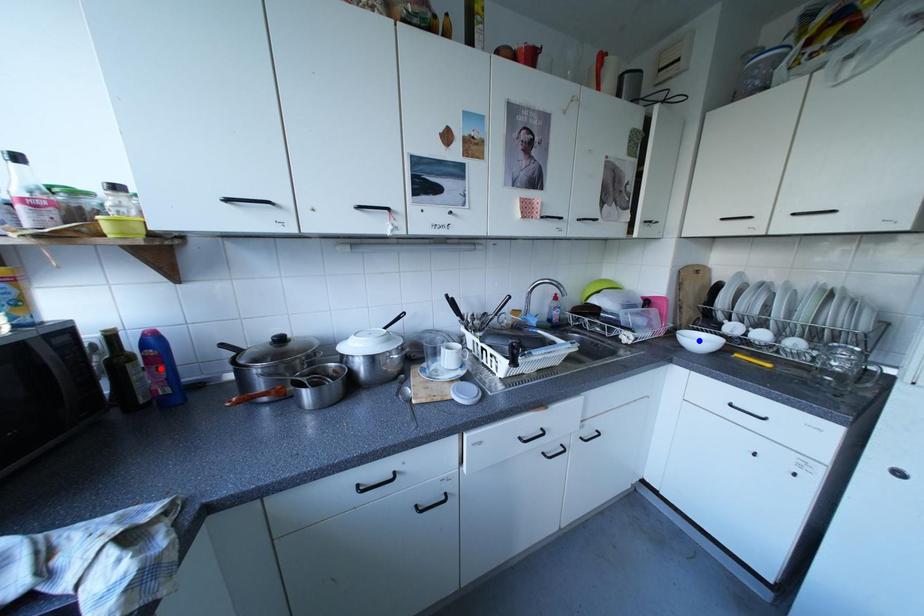
Question: In the image, two points are highlighted. Which point is nearer to the camera? Reply with the corresponding letter.

Choices:
 (A) blue point
 (B) red point

Answer: (B)